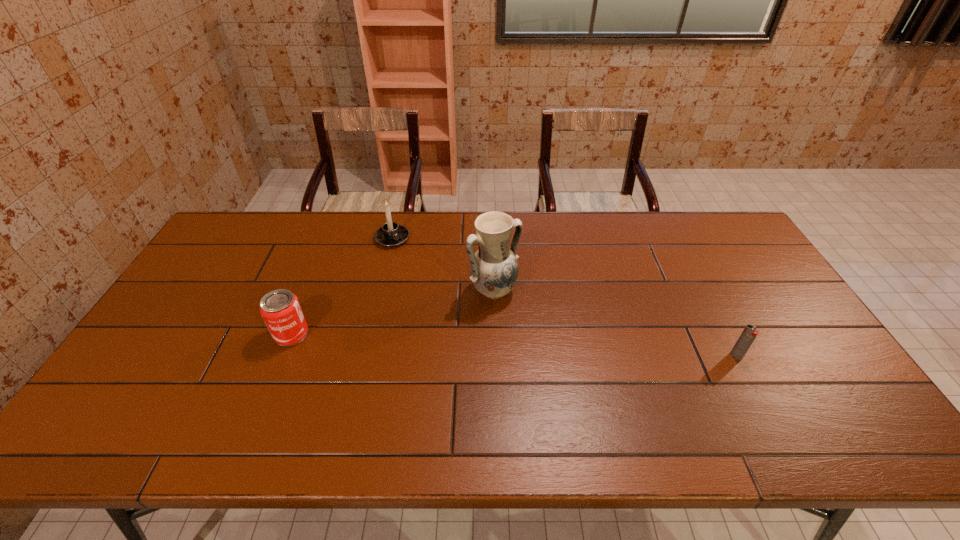
Image resolution: width=960 pixels, height=540 pixels. Identify the location of vacant space that is in between the can and the tallest object. (393, 312).

This screenshot has height=540, width=960. What are the coordinates of `free spot between the leftmost object and the nearest object` in the screenshot? It's located at (514, 345).

At what (x,y) coordinates should I click in order to perform the action: click on free point between the shortest object and the second shortest object. Please return your answer as a coordinate pair (x, y). The width and height of the screenshot is (960, 540). Looking at the image, I should click on (514, 345).

You are a GUI agent. You are given a task and a screenshot of the screen. Output one action in this format:
    pyautogui.click(x=<x>, y=<y>)
    Task: Click on the object that stands as the closest to the second nearest object
    The width and height of the screenshot is (960, 540).
    Given the screenshot: What is the action you would take?
    pyautogui.click(x=391, y=234)

Select which object is the closest to the can. Please provide its 2D coordinates. Your answer should be formatted as a tuple, i.e. [(x, y)], where the tuple contains the x and y coordinates of a point satisfying the conditions above.

[(391, 234)]

Image resolution: width=960 pixels, height=540 pixels. What are the coordinates of `free space in the image that satisfies the following two spatial constraints: 1. on the back side of the leftmost object; 2. on the left side of the third object from left to right` in the screenshot? It's located at (309, 291).

At what (x,y) coordinates should I click in order to perform the action: click on vacant point that satisfies the following two spatial constraints: 1. on the back side of the candle holder; 2. on the right side of the third farthest object. Please return your answer as a coordinate pair (x, y). Image resolution: width=960 pixels, height=540 pixels. Looking at the image, I should click on (x=330, y=238).

You are a GUI agent. You are given a task and a screenshot of the screen. Output one action in this format:
    pyautogui.click(x=<x>, y=<y>)
    Task: Click on the vacant space that satisfies the following two spatial constraints: 1. on the front side of the third object from right to left; 2. on the left side of the pottery
    
    Given the screenshot: What is the action you would take?
    pyautogui.click(x=380, y=291)